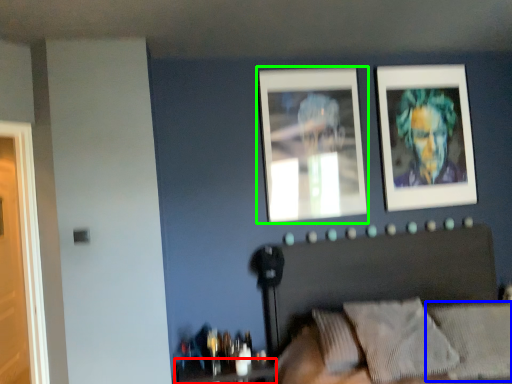
Question: Which is farther away from table (highlighted by a red box)? pillow (highlighted by a blue box) or picture frame (highlighted by a green box)?

Choices:
 (A) pillow
 (B) picture frame

Answer: (B)